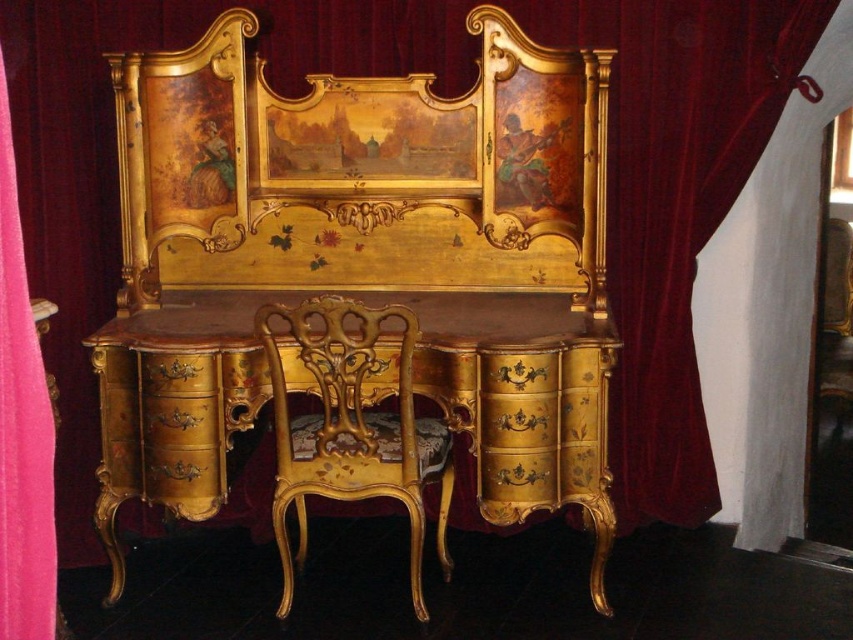
Can you confirm if gold carved wood chair at center is positioned above pink fabric curtain at left?

Incorrect, gold carved wood chair at center is not positioned above pink fabric curtain at left.

Does gold carved wood chair at center have a greater width compared to pink fabric curtain at left?

Indeed, gold carved wood chair at center has a greater width compared to pink fabric curtain at left.

I want to click on gold carved wood chair at center, so click(x=351, y=422).

In the scene shown: Which is below, gold painted desk at center or gold carved wood chair at center?

gold carved wood chair at center

In the scene shown: Does gold painted desk at center have a greater width compared to gold carved wood chair at center?

Correct, the width of gold painted desk at center exceeds that of gold carved wood chair at center.

This screenshot has height=640, width=853. I want to click on gold painted desk at center, so click(412, 390).

Is the position of gold painted desk at center less distant than that of pink fabric curtain at left?

That is False.

Between gold painted desk at center and pink fabric curtain at left, which one is positioned lower?

gold painted desk at center

What do you see at coordinates (412, 390) in the screenshot? I see `gold painted desk at center` at bounding box center [412, 390].

Locate an element on the screen. gold painted desk at center is located at coordinates (412, 390).